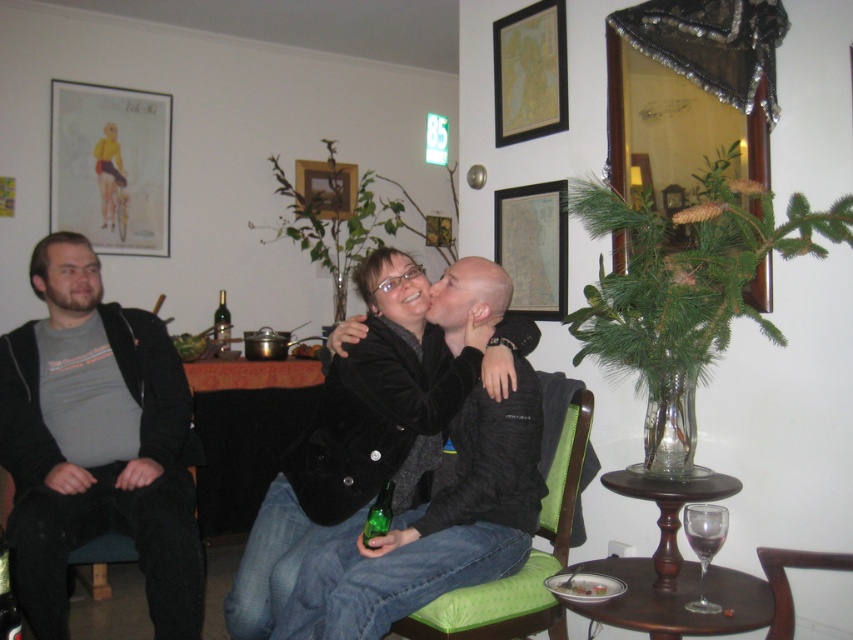
You are a photographer standing 1.8 meters away from the green fabric armchair at center. Can you comfortably take a photo of the people sitting there without moving closer?

The distance between you and the green fabric armchair at center is 1.81 meters, which is slightly more than your current position of 1.8 meters. Therefore, you can comfortably take a photo without needing to move closer.

Looking at this image, you are a photographer in this scene. You want to take a photo of the matte gray shirt at left and the green fabric armchair at center. Which object is covering the other?

The matte gray shirt at left is positioned over the green fabric armchair at center, so the matte gray shirt at left is covering the green fabric armchair at center.